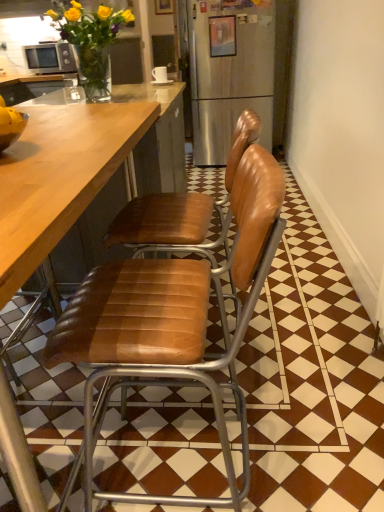
Question: Visually, is brown leather chair at center, the 2th chair from the front, positioned to the left or to the right of matte silver microwave at upper left?

Choices:
 (A) right
 (B) left

Answer: (A)

Question: From their relative heights in the image, would you say brown leather chair at center, the 2th chair from the front, is taller or shorter than matte silver microwave at upper left?

Choices:
 (A) tall
 (B) short

Answer: (A)

Question: Which is farther from the matte silver microwave at upper left?

Choices:
 (A) wooden picture frame at upper center, which is the 1th picture frame from back to front
 (B) metallic silver bowl at left
 (C) translucent glass vase at upper left
 (D) leather at center, which appears as the 1th chair when viewed from the front
 (E) wooden picture frame at upper center, the 1th picture frame in the front-to-back sequence

Answer: (D)

Question: Considering the real-world distances, which object is closest to the leather at center, the second chair positioned from the back?

Choices:
 (A) wooden picture frame at upper center, the 1th picture frame in the right-to-left sequence
 (B) metallic silver bowl at left
 (C) brown leather chair at center, which ranks as the 1th chair in back-to-front order
 (D) translucent glass vase at upper left
 (E) wooden picture frame at upper center, the 1th picture frame viewed from the left

Answer: (C)